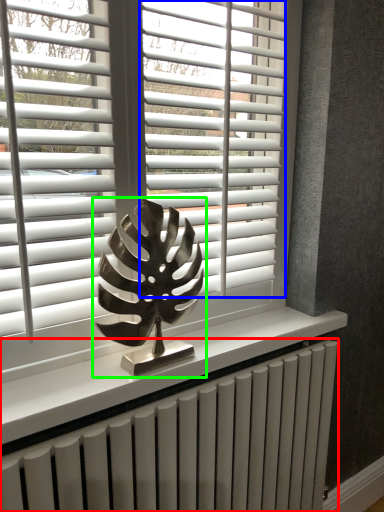
Question: Which is nearer to the radiator (highlighted by a red box)? blind (highlighted by a blue box) or sculpture (highlighted by a green box).

Choices:
 (A) blind
 (B) sculpture

Answer: (B)